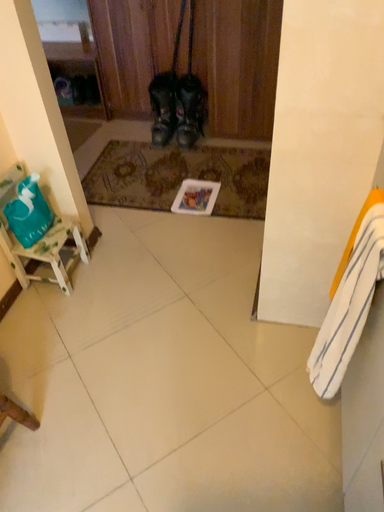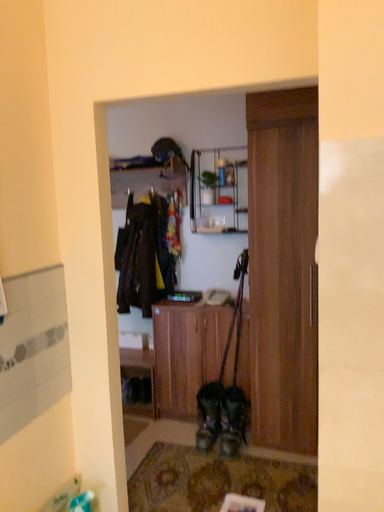
Question: How did the camera likely rotate when shooting the video?

Choices:
 (A) rotated downward
 (B) rotated upward

Answer: (B)